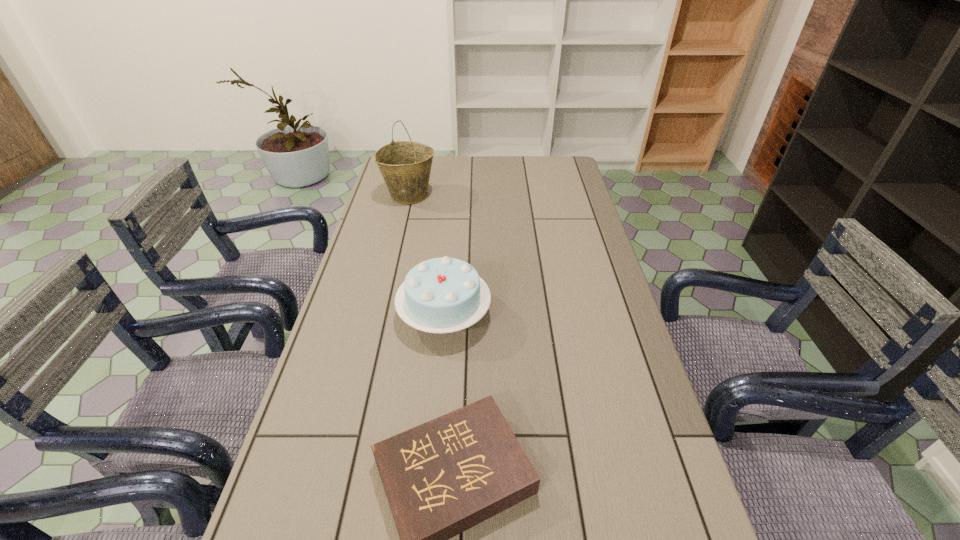
Locate an element on the screen. This screenshot has height=540, width=960. the tallest object is located at coordinates (405, 166).

What are the coordinates of `the farthest object` in the screenshot? It's located at (405, 166).

The image size is (960, 540). I want to click on the second nearest object, so click(x=441, y=295).

I want to click on the second shortest object, so click(441, 295).

I want to click on free space located on the right of the farthest object, so click(x=463, y=195).

What are the coordinates of `vacant space located on the back of the birthday cake` in the screenshot? It's located at (x=450, y=247).

Image resolution: width=960 pixels, height=540 pixels. I want to click on object that is at the far edge, so (405, 166).

Find the location of a particular element. The height and width of the screenshot is (540, 960). object located at the left edge is located at coordinates (405, 166).

This screenshot has width=960, height=540. Identify the location of object located at the far left corner. (405, 166).

The image size is (960, 540). In order to click on vacant space at the far edge of the desktop in this screenshot , I will do `click(439, 163)`.